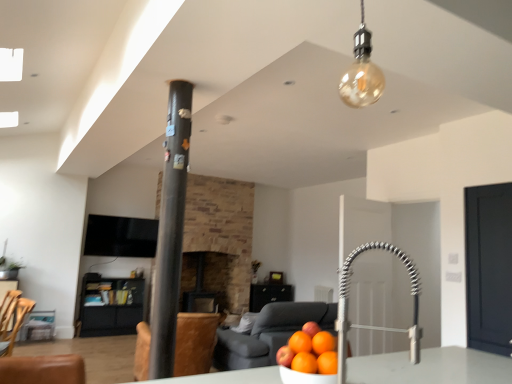
Question: In terms of height, does satin nickel faucet at center look taller or shorter compared to dark brown stone fireplace at center?

Choices:
 (A) short
 (B) tall

Answer: (A)

Question: Considering the positions of satin nickel faucet at center and dark brown stone fireplace at center in the image, is satin nickel faucet at center wider or thinner than dark brown stone fireplace at center?

Choices:
 (A) thin
 (B) wide

Answer: (A)

Question: Which of these objects is positioned farthest from the brown leather swivel chair at center, which is counted as the 1th swivel chair, starting from the right?

Choices:
 (A) amber glass bulb at upper center
 (B) dark matte door at right
 (C) dark brown stone fireplace at center
 (D) black textured pillar at center
 (E) wooden swivel chair at lower left, the 2th swivel chair viewed from the right

Answer: (A)

Question: Based on their relative distances, which object is nearer to the brown leather swivel chair at center, positioned as the second swivel chair in left-to-right order?

Choices:
 (A) black textured pillar at center
 (B) dark matte door at right
 (C) wooden swivel chair at lower left, which is the 2th swivel chair in back-to-front order
 (D) dark brown stone fireplace at center
 (E) black matte cabinet at lower left

Answer: (D)